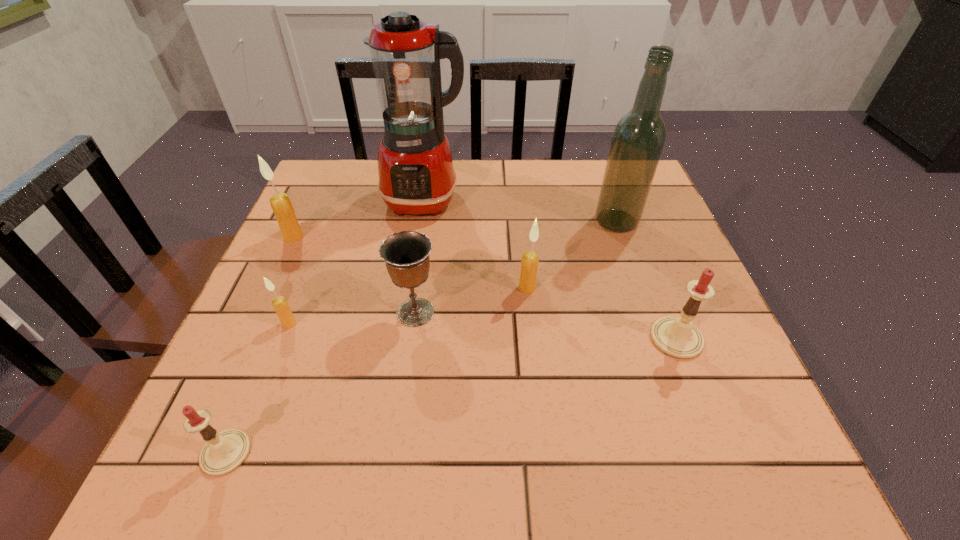
At what (x,y) coordinates should I click in order to perform the action: click on free space located on the back of the left red candle. Please return your answer as a coordinate pair (x, y). Looking at the image, I should click on (252, 392).

The height and width of the screenshot is (540, 960). What are the coordinates of `food processor that is at the far edge` in the screenshot? It's located at click(x=416, y=176).

Identify the location of liquor that is at the far edge. This screenshot has width=960, height=540. (638, 139).

Locate an element on the screen. This screenshot has height=540, width=960. object present at the near edge is located at coordinates (224, 452).

Where is `liquor present at the right edge`? The width and height of the screenshot is (960, 540). liquor present at the right edge is located at coordinates (638, 139).

I want to click on candle that is at the right edge, so click(x=677, y=337).

You are a GUI agent. You are given a task and a screenshot of the screen. Output one action in this format:
    pyautogui.click(x=<x>, y=<y>)
    Task: Click on the object that is at the near left corner
    
    Given the screenshot: What is the action you would take?
    click(x=224, y=452)

Where is `object that is at the far right corner`? This screenshot has width=960, height=540. object that is at the far right corner is located at coordinates (638, 139).

I want to click on free space at the far edge of the desktop, so click(x=550, y=182).

Where is `free space at the near edge`? This screenshot has width=960, height=540. free space at the near edge is located at coordinates (574, 465).